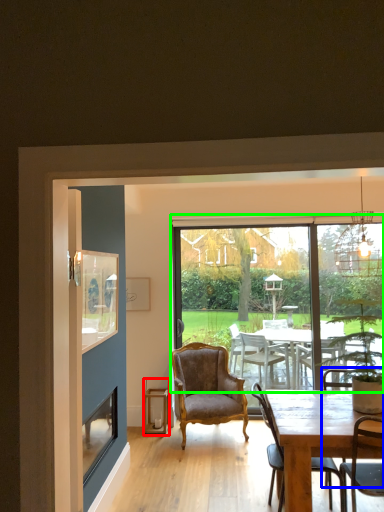
Question: Which object is positioned closest to lantern (highlighted by a red box)? Select from armchair (highlighted by a blue box) and window (highlighted by a green box).

Choices:
 (A) armchair
 (B) window

Answer: (B)